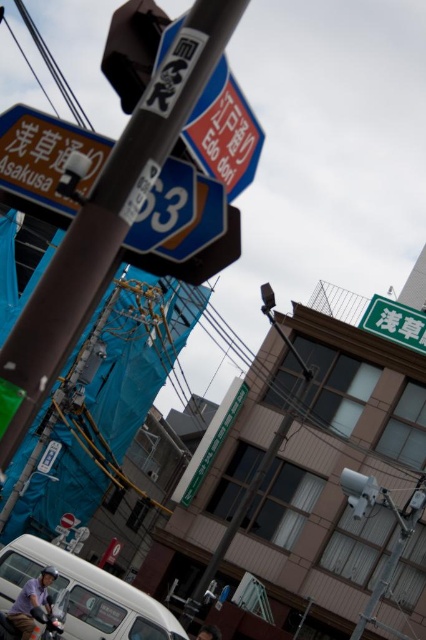
Question: Does metallic pole at center appear under metallic gray traffic light at center?

Choices:
 (A) no
 (B) yes

Answer: (A)

Question: Does metallic pole at center have a smaller size compared to matte black traffic light at upper center?

Choices:
 (A) yes
 (B) no

Answer: (A)

Question: Which point is farther to the camera?

Choices:
 (A) (368, 324)
 (B) (351, 486)
 (C) (319, 417)

Answer: (A)

Question: Which object is farther from the camera taking this photo?

Choices:
 (A) blue glossy road sign at upper left
 (B) green matte signboard at upper right
 (C) white matte van at lower left
 (D) metallic gray traffic light at center

Answer: (B)

Question: Estimate the real-world distances between objects in this image. Which object is closer to the metallic gray traffic light at center?

Choices:
 (A) blue glossy road sign at upper left
 (B) white matte van at lower left

Answer: (B)

Question: Does metallic pole at center appear on the right side of metallic gray traffic light at center?

Choices:
 (A) no
 (B) yes

Answer: (A)